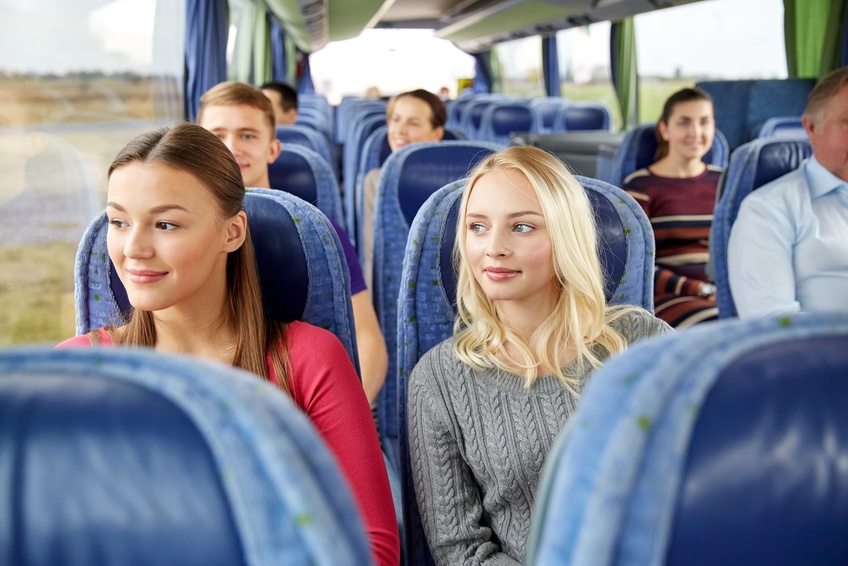
Identify the location of windows. (90, 122), (235, 35), (404, 67), (509, 75), (582, 59), (684, 60).